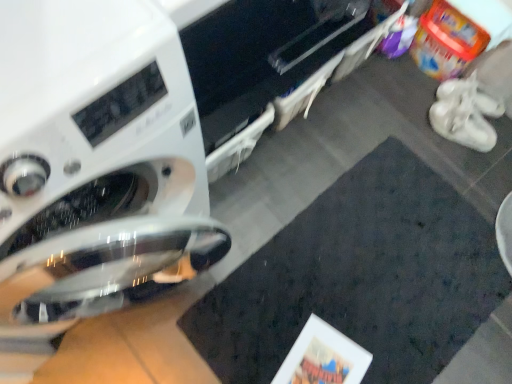
Identify the location of vacant space underneath white matte shoe at right (from a real-world perspective). (485, 105).